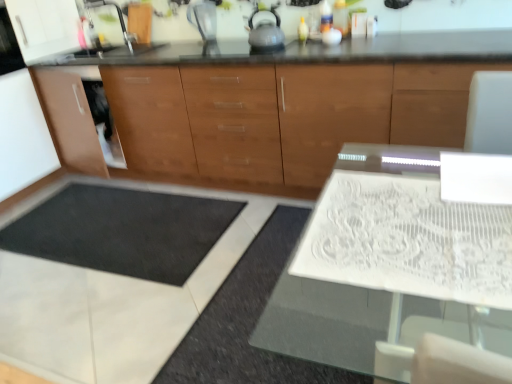
This screenshot has height=384, width=512. What do you see at coordinates (291, 104) in the screenshot?
I see `brown wood cabinet at center` at bounding box center [291, 104].

Find the location of a particular element. brown wood cabinet at center is located at coordinates [x=291, y=104].

This screenshot has height=384, width=512. There is a white glass table at center. Identify the location of tea pot above it (from a real-world perspective). (265, 34).

Is satin silver tea pot at upper center taller than white glass table at center?

No.

Which is in front, satin silver tea pot at upper center or white glass table at center?

white glass table at center is closer to the camera.

Does satin silver tea pot at upper center have a larger size compared to white glass table at center?

No.

Is transparent plastic blender at upper center looking in the opposite direction of satin silver tea pot at upper center?

No, satin silver tea pot at upper center is not at the back of transparent plastic blender at upper center.

Which of these two, transparent plastic blender at upper center or satin silver tea pot at upper center, stands shorter?

satin silver tea pot at upper center is shorter.

Does transparent plastic blender at upper center have a greater width compared to satin silver tea pot at upper center?

In fact, transparent plastic blender at upper center might be narrower than satin silver tea pot at upper center.

Is transparent plastic blender at upper center taller than white glass table at center?

No.

Between transparent plastic blender at upper center and white glass table at center, which one appears on the right side from the viewer's perspective?

From the viewer's perspective, white glass table at center appears more on the right side.

Considering the sizes of objects transparent plastic blender at upper center and white glass table at center in the image provided, who is thinner, transparent plastic blender at upper center or white glass table at center?

transparent plastic blender at upper center is thinner.

Is transparent plastic blender at upper center far from white glass table at center?

Yes, transparent plastic blender at upper center and white glass table at center are quite far apart.

Is the position of white glass table at center more distant than that of satin silver tea pot at upper center?

No.

Does point (369, 255) come in front of point (273, 36)?

Yes, it is.

Is white glass table at center taller or shorter than satin silver tea pot at upper center?

In the image, white glass table at center appears to be taller than satin silver tea pot at upper center.

Considering the relative positions of white glass table at center and satin silver tea pot at upper center in the image provided, is white glass table at center to the right of satin silver tea pot at upper center from the viewer's perspective?

Indeed, white glass table at center is positioned on the right side of satin silver tea pot at upper center.

From the image's perspective, is brown wood cabinet at center positioned above or below white glass table at center?

Based on their image positions, brown wood cabinet at center is located above white glass table at center.

Does brown wood cabinet at center have a lesser width compared to white glass table at center?

Indeed, brown wood cabinet at center has a lesser width compared to white glass table at center.

Does point (227, 168) lie behind point (320, 287)?

Yes, point (227, 168) is behind point (320, 287).

Based on the photo, considering the positions of objects brown wood cabinet at center and white glass table at center in the image provided, who is more to the right, brown wood cabinet at center or white glass table at center?

Positioned to the right is white glass table at center.

The height and width of the screenshot is (384, 512). Find the location of `cabinetry in front of the transparent plastic blender at upper center`. cabinetry in front of the transparent plastic blender at upper center is located at coordinates (291, 104).

Which of these two, brown wood cabinet at center or transparent plastic blender at upper center, stands shorter?

With less height is transparent plastic blender at upper center.

Are brown wood cabinet at center and transparent plastic blender at upper center beside each other?

brown wood cabinet at center and transparent plastic blender at upper center are not in contact.

Considering the positions of objects white glass table at center and transparent plastic blender at upper center in the image provided, who is in front, white glass table at center or transparent plastic blender at upper center?

white glass table at center.

Identify the location of table below the transparent plastic blender at upper center (from the image's perspective). This screenshot has width=512, height=384. (391, 267).

From a real-world perspective, is white glass table at center positioned above or below transparent plastic blender at upper center?

Clearly, from a real-world perspective, white glass table at center is below transparent plastic blender at upper center.

What's the angular difference between white glass table at center and transparent plastic blender at upper center's facing directions?

They differ by 1.02 degrees in their facing directions.

Identify the location of table in front of the satin silver tea pot at upper center. The height and width of the screenshot is (384, 512). (391, 267).

Image resolution: width=512 pixels, height=384 pixels. I want to click on appliance that appears above the satin silver tea pot at upper center (from a real-world perspective), so click(203, 18).

When comparing their distances from brown wood cabinet at center, does transparent plastic blender at upper center or white glass table at center seem further?

Based on the image, white glass table at center appears to be further to brown wood cabinet at center.

From the image, which object appears to be nearer to white glass table at center, satin silver tea pot at upper center or brown wood cabinet at center?

brown wood cabinet at center.

Which object lies nearer to the anchor point satin silver tea pot at upper center, brown wood cabinet at center or transparent plastic blender at upper center?

Among the two, transparent plastic blender at upper center is located nearer to satin silver tea pot at upper center.

From the image, which object appears to be farther from satin silver tea pot at upper center, transparent plastic blender at upper center or brown wood cabinet at center?

brown wood cabinet at center.

Estimate the real-world distances between objects in this image. Which object is closer to white glass table at center, transparent plastic blender at upper center or brown wood cabinet at center?

brown wood cabinet at center is closer to white glass table at center.

Considering their positions, is transparent plastic blender at upper center positioned closer to satin silver tea pot at upper center than white glass table at center?

Based on the image, transparent plastic blender at upper center appears to be nearer to satin silver tea pot at upper center.

Estimate the real-world distances between objects in this image. Which object is further from transparent plastic blender at upper center, satin silver tea pot at upper center or white glass table at center?

Among the two, white glass table at center is located further to transparent plastic blender at upper center.

Looking at the image, which one is located further to brown wood cabinet at center, satin silver tea pot at upper center or white glass table at center?

Among the two, white glass table at center is located further to brown wood cabinet at center.

I want to click on cabinetry positioned between white glass table at center and transparent plastic blender at upper center from near to far, so click(291, 104).

The width and height of the screenshot is (512, 384). What are the coordinates of `tea pot located between brown wood cabinet at center and transparent plastic blender at upper center in the depth direction` in the screenshot? It's located at (265, 34).

This screenshot has height=384, width=512. What are the coordinates of `tea pot positioned between white glass table at center and transparent plastic blender at upper center from near to far` in the screenshot? It's located at (265, 34).

Identify the location of cabinetry between white glass table at center and satin silver tea pot at upper center along the z-axis. This screenshot has height=384, width=512. (291, 104).